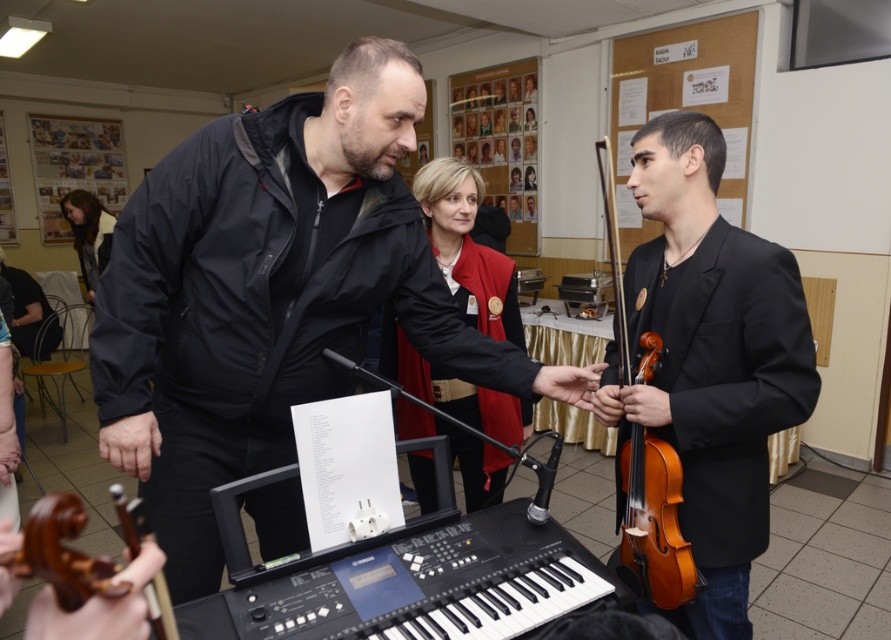
You are a photographer setting up for a group photo. You need to ensure that the black matte jacket at center and the black plastic keyboard at center are both visible in the frame. Given their heights, which object should you position closer to the camera to avoid one blocking the other?

The black plastic keyboard at center is shorter than the black matte jacket at center. To prevent the jacket from blocking the keyboard, position the keyboard closer to the camera so it remains visible.